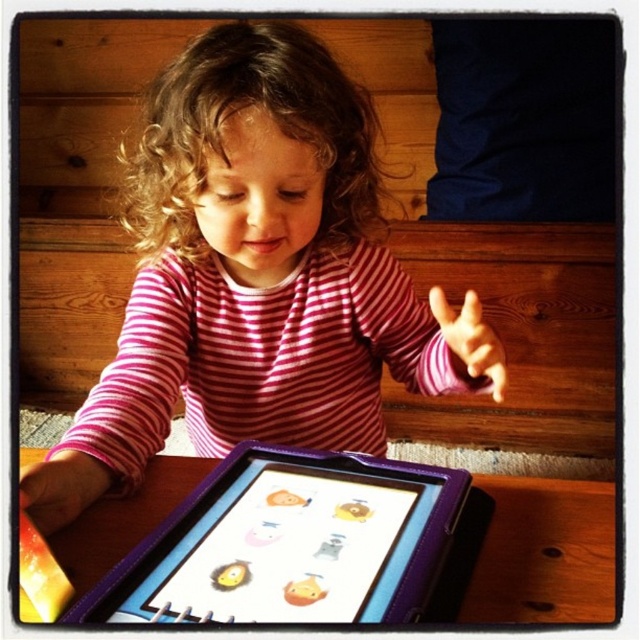
Can you confirm if pink fabric hand at center is positioned above matte yellow crayon at lower left?

Correct, pink fabric hand at center is located above matte yellow crayon at lower left.

Does pink fabric hand at center have a greater width compared to matte yellow crayon at lower left?

Yes, pink fabric hand at center is wider than matte yellow crayon at lower left.

Is point (468, 308) positioned after point (40, 605)?

Yes, point (468, 308) is farther from viewer.

Where is `pink fabric hand at center`? This screenshot has width=640, height=640. pink fabric hand at center is located at coordinates (470, 339).

Can you confirm if purple leather tablet at lower center is positioned above pink fabric hand at center?

No.

In the scene shown: Is purple leather tablet at lower center taller than pink fabric hand at center?

No, purple leather tablet at lower center is not taller than pink fabric hand at center.

Who is more distant from viewer, (397, 541) or (460, 310)?

Positioned behind is point (460, 310).

Locate an element on the screen. purple leather tablet at lower center is located at coordinates (289, 544).

Is point (188, 349) farther from viewer compared to point (52, 580)?

Yes, it is behind point (52, 580).

Between pink striped shirt at center and matte yellow crayon at lower left, which one is positioned lower?

matte yellow crayon at lower left is below.

What do you see at coordinates (257, 264) in the screenshot?
I see `pink striped shirt at center` at bounding box center [257, 264].

The width and height of the screenshot is (640, 640). What are the coordinates of `pink striped shirt at center` in the screenshot? It's located at (257, 264).